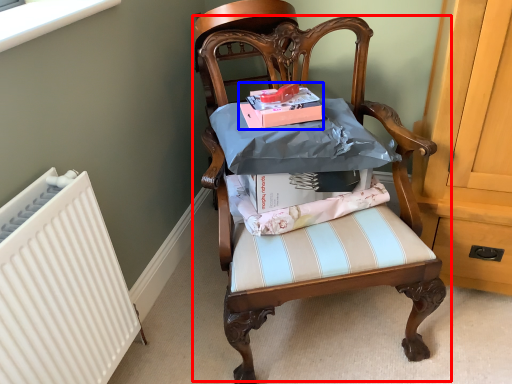
Question: Which point is closer to the camera, chair (highlighted by a red box) or magazine (highlighted by a blue box)?

Choices:
 (A) chair
 (B) magazine

Answer: (A)